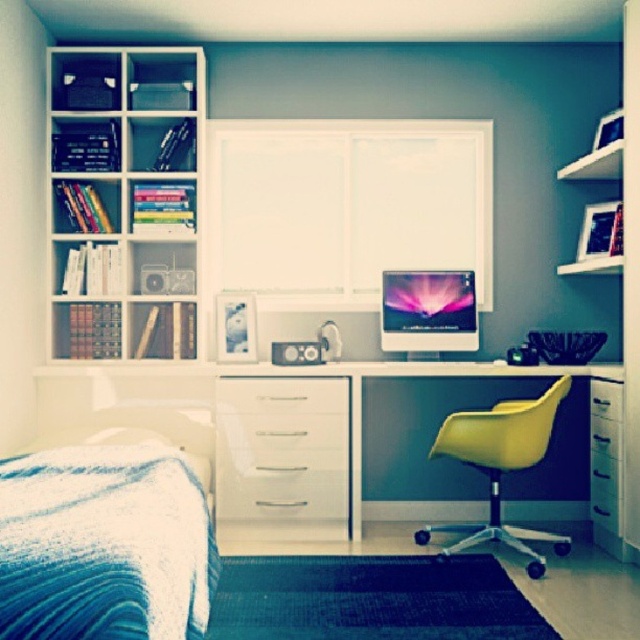
Question: Which of the following is the farthest from the observer?

Choices:
 (A) matte white bookshelf at upper left
 (B) white glossy drawer at center
 (C) blue textured blanket at lower left

Answer: (A)

Question: Is blue textured blanket at lower left to the left of white wood shelf at upper right from the viewer's perspective?

Choices:
 (A) yes
 (B) no

Answer: (A)

Question: Among these points, which one is farthest from the camera?

Choices:
 (A) (616, 115)
 (B) (186, 131)
 (C) (193, 364)
 (D) (474, 273)

Answer: (D)

Question: Does matte white bookshelf at upper left appear on the left side of yellow matte swivel chair at center?

Choices:
 (A) yes
 (B) no

Answer: (A)

Question: Which object is farther from the camera taking this photo?

Choices:
 (A) white glossy drawer at center
 (B) matte white bookshelf at upper left
 (C) yellow matte swivel chair at center

Answer: (B)

Question: Considering the relative positions of yellow matte swivel chair at center and white wood shelf at upper right in the image provided, where is yellow matte swivel chair at center located with respect to white wood shelf at upper right?

Choices:
 (A) below
 (B) above

Answer: (A)